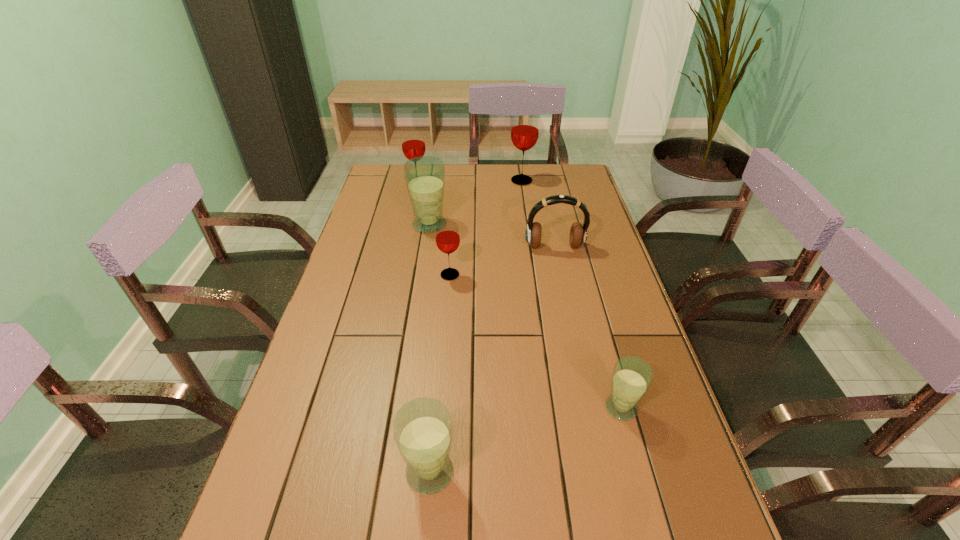
Find the location of `object present at the left edge`. object present at the left edge is located at coordinates (413, 143).

Locate an element on the screen. This screenshot has width=960, height=540. headset located in the right edge section of the desktop is located at coordinates (578, 233).

Where is `glass present at the right edge`? glass present at the right edge is located at coordinates (631, 378).

Locate an element on the screen. object at the far left corner is located at coordinates (413, 143).

This screenshot has width=960, height=540. I want to click on vacant region at the far edge of the desktop, so [x=509, y=165].

Image resolution: width=960 pixels, height=540 pixels. I want to click on vacant space at the left edge of the desktop, so click(358, 256).

In the image, there is a desktop. At what (x,y) coordinates should I click in order to perform the action: click on free region at the right edge. Please return your answer as a coordinate pair (x, y). Looking at the image, I should click on (553, 213).

The height and width of the screenshot is (540, 960). In the image, there is a desktop. Identify the location of vacant region at the far left corner. (390, 169).

This screenshot has height=540, width=960. Identify the location of vacant position at the far right corner of the desktop. coord(569,186).

Where is `free space between the nearest red glass and the brown headset`? This screenshot has width=960, height=540. free space between the nearest red glass and the brown headset is located at coordinates (502, 261).